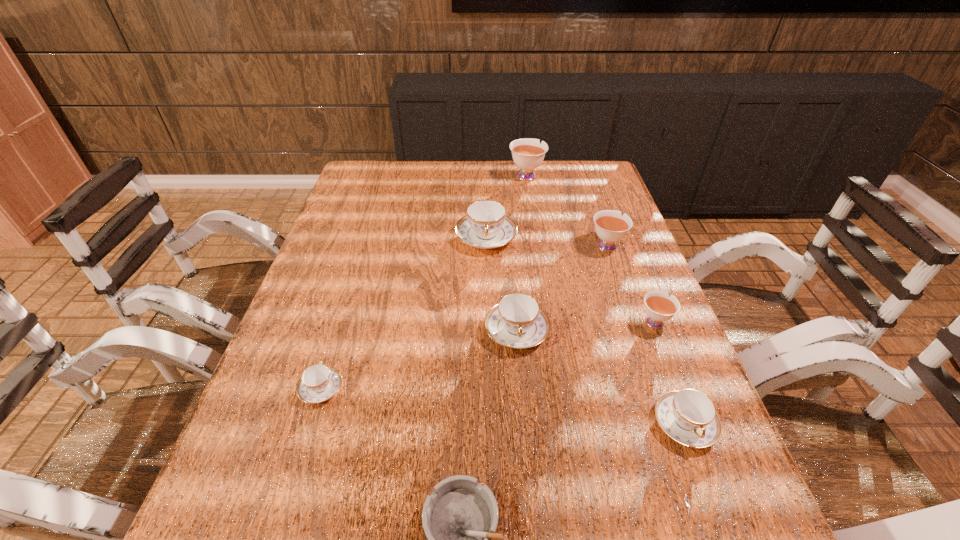
At what (x,y) coordinates should I click in order to perform the action: click on free space between the farthest teacup and the second farthest blue teacup. Please return your answer as a coordinate pair (x, y). The width and height of the screenshot is (960, 540). Looking at the image, I should click on (521, 253).

Identify the location of empty space that is in between the biggest white teacup and the biggest blue teacup. The height and width of the screenshot is (540, 960). (x=506, y=206).

The width and height of the screenshot is (960, 540). What are the coordinates of `free point between the third nearest blue teacup and the nearest white teacup` in the screenshot? It's located at (586, 326).

This screenshot has height=540, width=960. I want to click on vacant area that lies between the second farthest white teacup and the smallest white teacup, so click(x=630, y=283).

At what (x,y) coordinates should I click in order to perform the action: click on object identified as the closest to the second farthest blue teacup. Please return your answer as a coordinate pair (x, y). The image size is (960, 540). Looking at the image, I should click on (486, 225).

Identify which object is the seventh nearest to the smallest white teacup. Please provide its 2D coordinates. Your answer should be formatted as a tuple, i.e. [(x, y)], where the tuple contains the x and y coordinates of a point satisfying the conditions above.

[(319, 382)]

Identify which teacup is the sixth closest to the farthest blue teacup. Please provide its 2D coordinates. Your answer should be formatted as a tuple, i.e. [(x, y)], where the tuple contains the x and y coordinates of a point satisfying the conditions above.

[(688, 416)]

Choose which teacup is the third nearest neighbor to the second smallest blue teacup. Please provide its 2D coordinates. Your answer should be formatted as a tuple, i.e. [(x, y)], where the tuple contains the x and y coordinates of a point satisfying the conditions above.

[(610, 225)]

This screenshot has width=960, height=540. In order to click on the closest white teacup relative to the second farthest blue teacup in this screenshot , I will do `click(659, 307)`.

Locate which white teacup ranks in proximity to the nearest object. Please provide its 2D coordinates. Your answer should be formatted as a tuple, i.e. [(x, y)], where the tuple contains the x and y coordinates of a point satisfying the conditions above.

[(659, 307)]